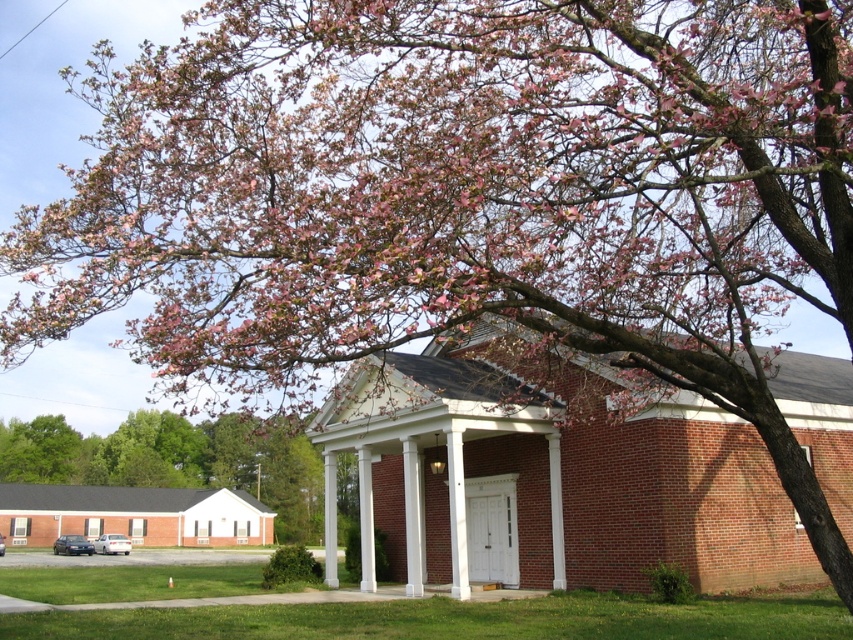
You are a photographer setting up a shot of the white brick porch at center and the pink blossom tree at upper left. Which object is closer to the left edge of your frame?

The pink blossom tree at upper left is closer to the left edge of the frame since the white brick porch at center is positioned to its right.

You are standing at the point with coordinates point (96, 378) and want to walk towards the brick building with a white portico. Is the point (718, 532) blocking your path?

Point (718, 532) is in front of point (96, 378), so yes, the point (718, 532) is blocking your path towards the brick building with a white portico.

You are a delivery person trying to determine if your 1.8 meter tall package can be placed on the white brick porch at center without hitting the white smooth column at center. Can it fit vertically?

The white brick porch at center is much taller than the white smooth column at center, so the 1.8 meter tall package can be placed vertically on the white brick porch at center without hitting the column.